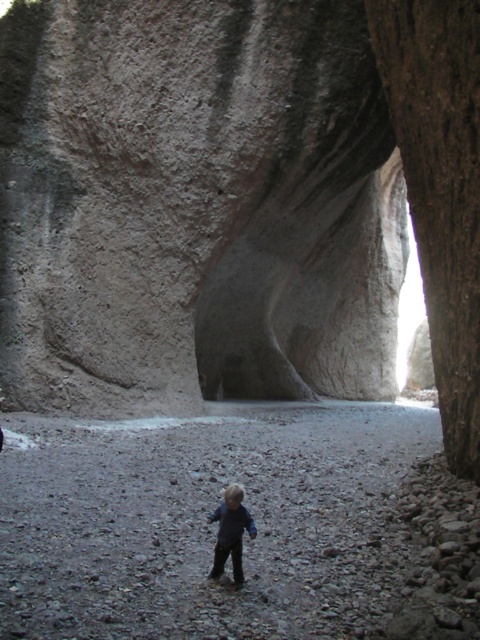
Can you confirm if gray rough rock face at center is taller than dark blue jeans at center?

Yes, gray rough rock face at center is taller than dark blue jeans at center.

Between gray rough rock face at center and dark blue jeans at center, which one appears on the right side from the viewer's perspective?

Positioned to the right is gray rough rock face at center.

Locate an element on the screen. The height and width of the screenshot is (640, 480). gray rough rock face at center is located at coordinates (195, 204).